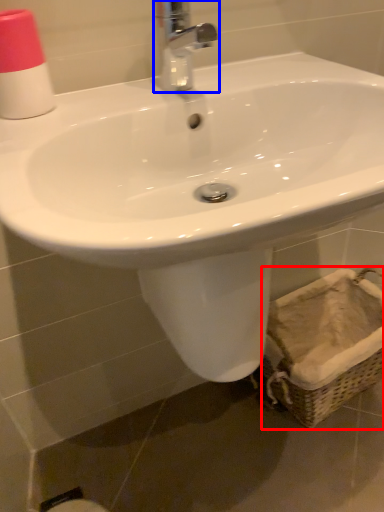
Question: Among these objects, which one is farthest to the camera, basket (highlighted by a red box) or tap (highlighted by a blue box)?

Choices:
 (A) basket
 (B) tap

Answer: (A)